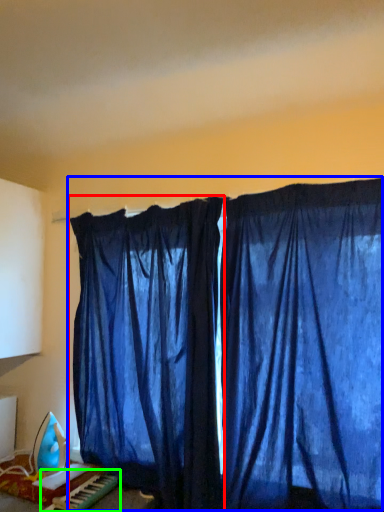
Question: Which object is positioned farthest from curtain (highlighted by a red box)? Select from curtain (highlighted by a blue box) and musical keyboard (highlighted by a green box).

Choices:
 (A) curtain
 (B) musical keyboard

Answer: (B)